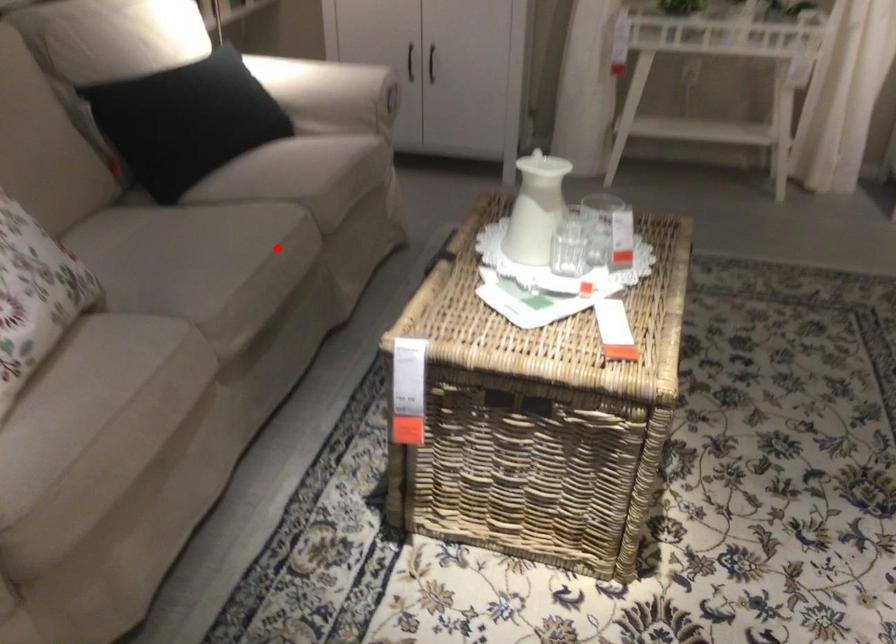
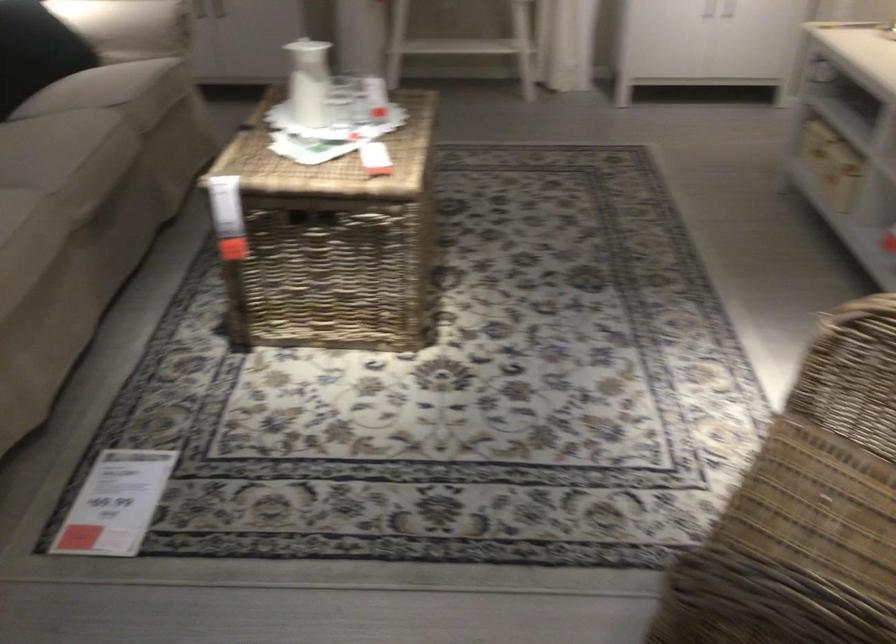
Question: A red point is marked in image1. In image2, is the corresponding 3D point closer to the camera or farther? Reply with the corresponding letter.

Choices:
 (A) The corresponding 3D point is closer.
 (B) The corresponding 3D point is farther.

Answer: (B)